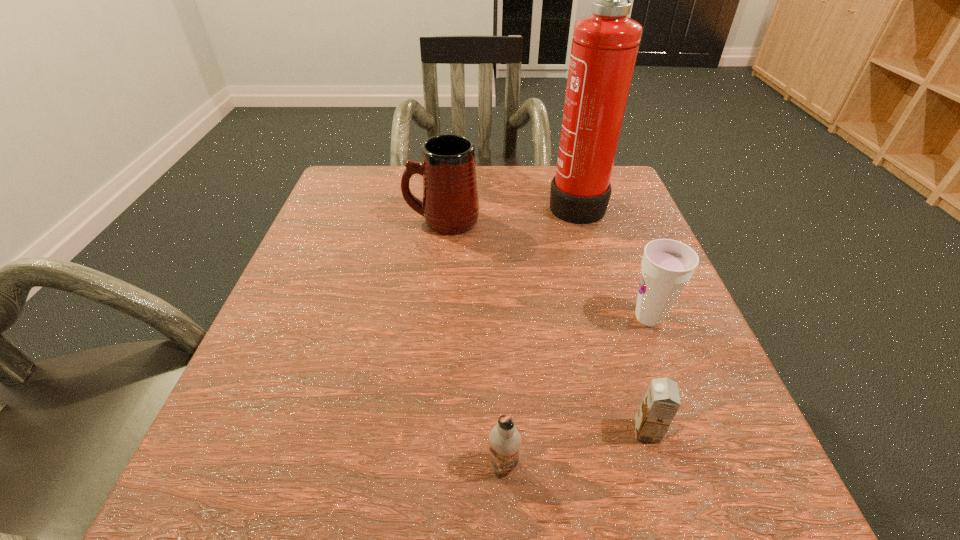
The image size is (960, 540). Find the location of `object that is at the near edge`. object that is at the near edge is located at coordinates (505, 440).

You are a GUI agent. You are given a task and a screenshot of the screen. Output one action in this format:
    pyautogui.click(x=<x>, y=<y>)
    Task: Click on the fire extinguisher positioned at the right edge
    
    Given the screenshot: What is the action you would take?
    pyautogui.click(x=604, y=49)

Identify the location of cup present at the right edge. (667, 265).

This screenshot has width=960, height=540. In order to click on chocolate milk present at the right edge in this screenshot , I will do `click(661, 402)`.

Identify the location of object at the far right corner. The image size is (960, 540). (604, 49).

Locate an element on the screen. free space at the far edge of the desktop is located at coordinates (486, 175).

The height and width of the screenshot is (540, 960). In the image, there is a desktop. What are the coordinates of `blank space at the near edge` in the screenshot? It's located at (387, 467).

Find the location of `blank space at the left edge of the desktop`. blank space at the left edge of the desktop is located at coordinates (303, 397).

The height and width of the screenshot is (540, 960). Identify the location of vacant space at the right edge. (647, 369).

At what (x,y) coordinates should I click in order to perform the action: click on vacant area at the far left corner. Please return your answer as a coordinate pair (x, y). Looking at the image, I should click on pos(355,188).